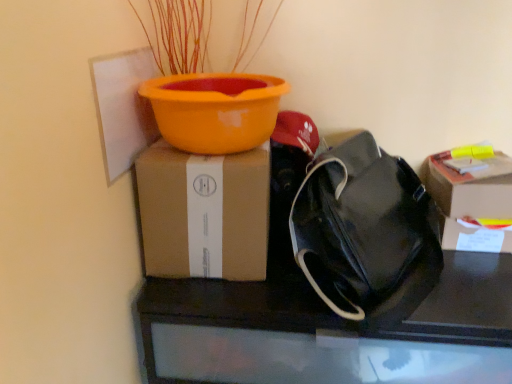
Identify the location of empty space that is ontop of black leather bag at center. (406, 278).